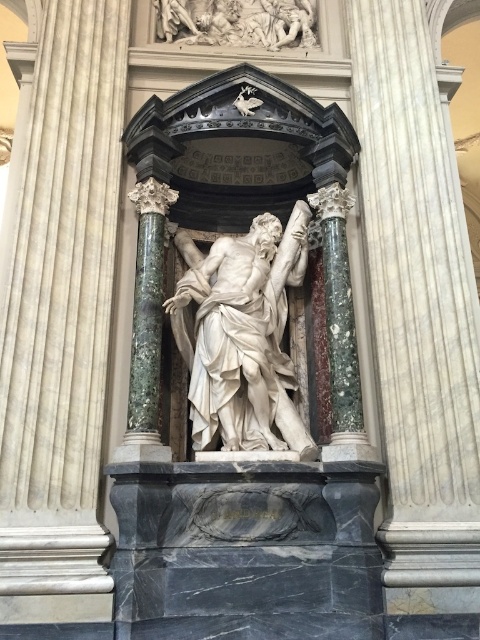
Does white marble column at center appear over white marble statue at center?

Yes, white marble column at center is above white marble statue at center.

Does point (78, 129) lie behind point (225, 340)?

Yes.

Who is more forward, [83,538] or [188,320]?

Point [83,538]

This screenshot has height=640, width=480. What are the coordinates of `white marble column at center` in the screenshot? It's located at (61, 316).